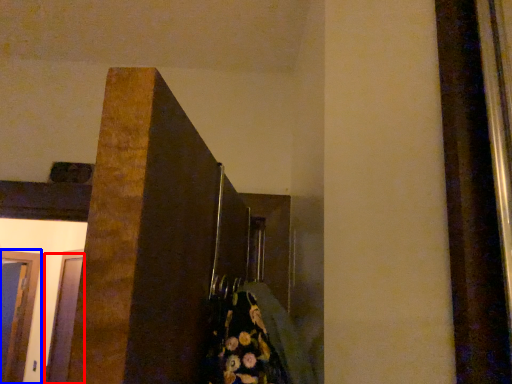
Question: Which object is further to the camera taking this photo, glass door (highlighted by a red box) or glass door (highlighted by a blue box)?

Choices:
 (A) glass door
 (B) glass door

Answer: (B)